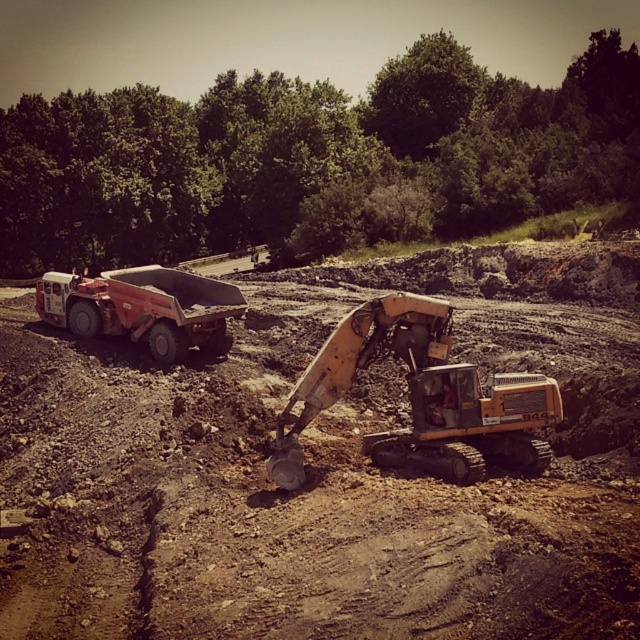
You are a drone operator trying to capture aerial footage of the construction site. There are two points of interest marked on your screen at coordinates point (452, 307) and point (164, 301). Which point should you focus on to ensure it appears larger in your footage?

Point (452, 307) is closer to the camera than point (164, 301), so focusing on point (452, 307) will make it appear larger in the footage.

You are a construction worker standing at the point labeled point (x=420, y=397). You need to move to the red dump truck parked on the left side of the frame. Which direction should you walk to reach the red dump truck parked on the left side of the frame?

The point labeled point (x=420, y=397) is located on the yellow metallic excavator at center. Since the red dump truck parked on the left side of the frame is positioned to the left of the excavator, you should walk to the left to reach the red dump truck parked on the left side of the frame.

From the picture: You are an equipment operator at a construction site. You need to determine which piece of equipment is smaller in size between the yellow metallic excavator at center and the matte red truck at left. Which one is smaller?

The yellow metallic excavator at center is smaller in size compared to the matte red truck at left according to the description.